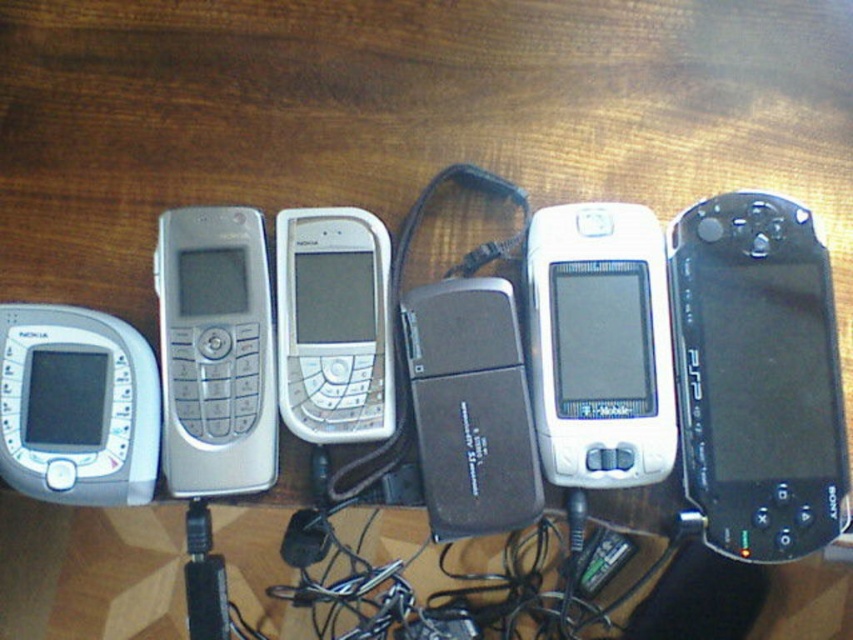
You are a delivery person who needs to place a new package on the wooden surface. The package requires at least 36 inches of space between it and the black matte psp at right to avoid interference. Can you place the package near the other devices without violating this requirement?

The black matte psp at right and camera are 34.21 inches apart from each other, which is less than the required 36 inches. Therefore, placing the package near the other devices would not meet the spacing requirement.

You are organizing these devices and need to place a new item between the silver metallic phone at center and the black plastic usb drive at center. The new item is 3 inches long. Will there be enough space between them to fit the new item?

The silver metallic phone at center and the black plastic usb drive at center are 2.80 inches apart. Since the new item is 3 inches long, which is longer than the available space, there won not be enough space to fit it between them.